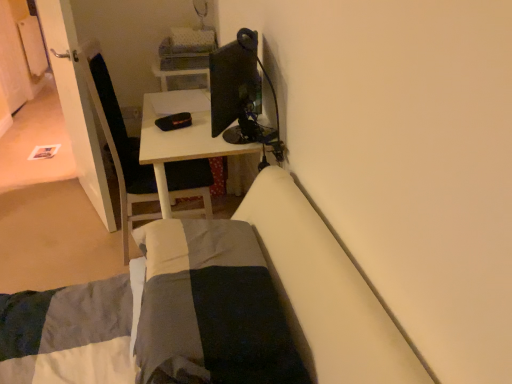
Question: Is white glossy door at left touching white glossy desk at center?

Choices:
 (A) yes
 (B) no

Answer: (B)

Question: From the image's perspective, would you say white glossy door at left is positioned over white glossy desk at center?

Choices:
 (A) no
 (B) yes

Answer: (B)

Question: Is white glossy door at left smaller than white glossy desk at center?

Choices:
 (A) yes
 (B) no

Answer: (A)

Question: Considering the relative sizes of white glossy door at left and white glossy desk at center in the image provided, is white glossy door at left shorter than white glossy desk at center?

Choices:
 (A) yes
 (B) no

Answer: (B)

Question: Is white glossy door at left aimed at white glossy desk at center?

Choices:
 (A) yes
 (B) no

Answer: (B)

Question: Is white glossy door at left thinner than white glossy desk at center?

Choices:
 (A) yes
 (B) no

Answer: (A)

Question: Is white glossy desk at center turned away from dark gray cotton blanket at lower center?

Choices:
 (A) yes
 (B) no

Answer: (B)

Question: Considering the relative sizes of white glossy desk at center and dark gray cotton blanket at lower center in the image provided, is white glossy desk at center thinner than dark gray cotton blanket at lower center?

Choices:
 (A) yes
 (B) no

Answer: (B)

Question: Could you tell me if white glossy desk at center is facing dark gray cotton blanket at lower center?

Choices:
 (A) yes
 (B) no

Answer: (B)

Question: Does white glossy desk at center come behind dark gray cotton blanket at lower center?

Choices:
 (A) no
 (B) yes

Answer: (B)

Question: Are white glossy desk at center and dark gray cotton blanket at lower center located far from each other?

Choices:
 (A) yes
 (B) no

Answer: (B)

Question: Is white glossy desk at center touching dark gray cotton blanket at lower center?

Choices:
 (A) no
 (B) yes

Answer: (A)

Question: Is dark gray cotton blanket at lower center far from white glossy desk at center?

Choices:
 (A) yes
 (B) no

Answer: (B)